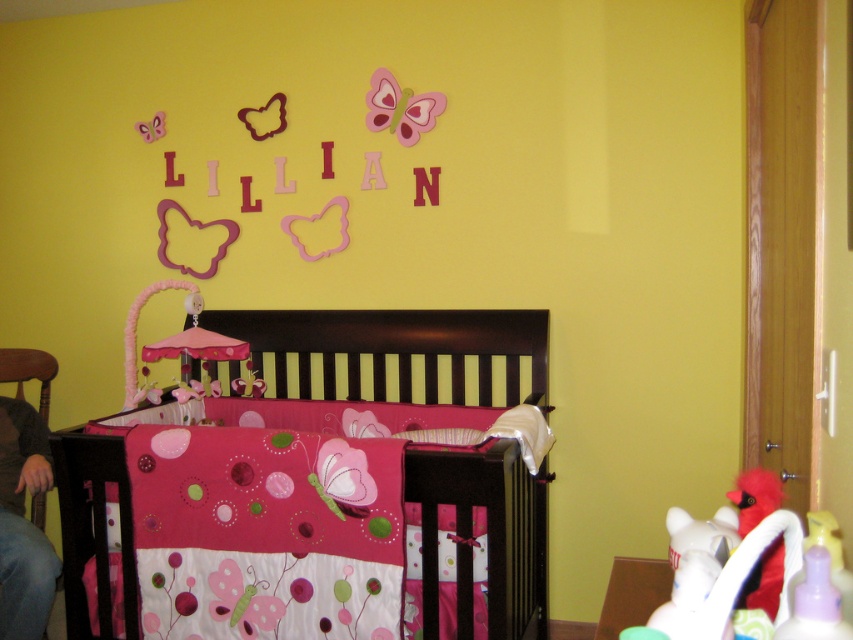
Based on the photo, you are a parent entering the nursery to change a diaper. You need to locate the jeans at lower left. Based on the coordinates given, where should you look relative to the crib?

The jeans at lower left are located at coordinates point [22,524], which is to the lower left side of the crib.

You need to place a rectangular storage box that is 1.2 meters wide between the jeans at lower left and the green plastic changing table at lower right. Based on the scene description, will the storage box fit between them?

The jeans at lower left is wider than the green plastic changing table at lower right, so the storage box may not fit if the space between them is narrower than 1.2 meters. However, since the exact distance isn not provided, it is uncertain.